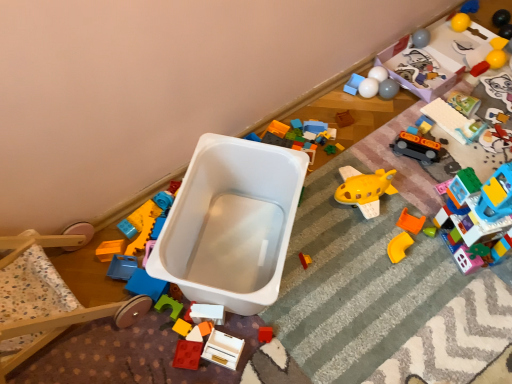
I want to click on vacant region to the left of wooden toy box at center, the thirteenth toy positioned from the right, so click(x=164, y=345).